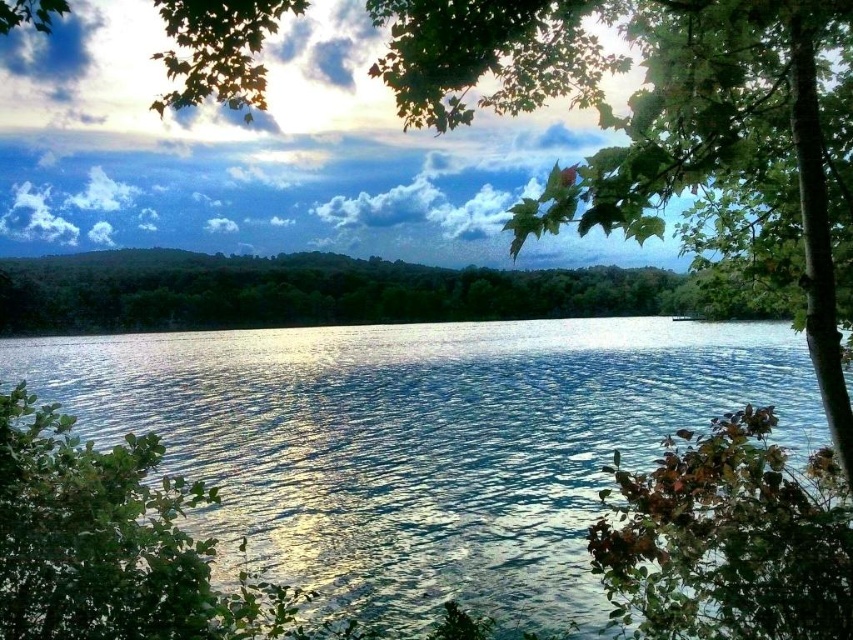
Question: Does green leafy bush at lower right appear under green leafy tree at lower left?

Choices:
 (A) yes
 (B) no

Answer: (B)

Question: Which of the following is the farthest from the observer?

Choices:
 (A) (57, 412)
 (B) (743, 618)
 (C) (196, 520)

Answer: (C)

Question: Among these points, which one is farthest from the camera?

Choices:
 (A) 196,484
 (B) 183,429
 (C) 846,609

Answer: (B)

Question: Estimate the real-world distances between objects in this image. Which object is closer to the green leafy bush at lower right?

Choices:
 (A) green leafy tree at lower left
 (B) glistening blue water at center

Answer: (A)

Question: In this image, where is glistening blue water at center located relative to green leafy bush at lower right?

Choices:
 (A) above
 (B) below

Answer: (A)

Question: In this image, where is green leafy bush at lower right located relative to green leafy tree at lower left?

Choices:
 (A) right
 (B) left

Answer: (A)